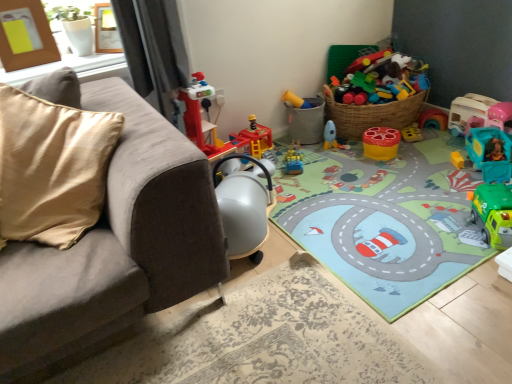
The width and height of the screenshot is (512, 384). In order to click on vacant space that is in between teal plastic toy car at right, arranged as the 6th toy when viewed from the left, and yellow matte stool at center, placed as the fourth toy when sorted from right to left in this screenshot , I will do `click(426, 144)`.